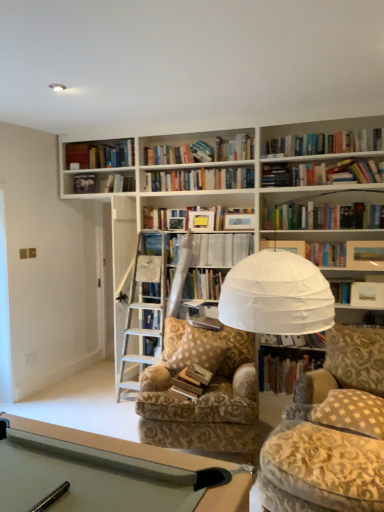
Question: From a real-world perspective, is brown checkered pillow at center, which ranks as the first pillow in left-to-right order, located beneath hardcover book at center?

Choices:
 (A) yes
 (B) no

Answer: (A)

Question: Is brown checkered pillow at center, the 1th pillow viewed from the back, facing away from hardcover book at center?

Choices:
 (A) no
 (B) yes

Answer: (B)

Question: From a real-world perspective, is brown checkered pillow at center, the second pillow when ordered from front to back, physically above hardcover book at center?

Choices:
 (A) yes
 (B) no

Answer: (B)

Question: From the image's perspective, would you say brown checkered pillow at center, the second pillow when ordered from front to back, is shown under hardcover book at center?

Choices:
 (A) yes
 (B) no

Answer: (A)

Question: Considering the relative sizes of brown checkered pillow at center, the 1th pillow viewed from the back, and hardcover book at center in the image provided, is brown checkered pillow at center, the 1th pillow viewed from the back, thinner than hardcover book at center?

Choices:
 (A) no
 (B) yes

Answer: (A)

Question: Is white paper at center, which is the 1th book in top-to-bottom order, wider or thinner than patterned fabric chair at center?

Choices:
 (A) thin
 (B) wide

Answer: (A)

Question: Is white paper at center, which is the 1th book in top-to-bottom order, spatially inside patterned fabric chair at center, or outside of it?

Choices:
 (A) outside
 (B) inside

Answer: (A)

Question: From their relative heights in the image, would you say white paper at center, the 4th book when ordered from bottom to top, is taller or shorter than patterned fabric chair at center?

Choices:
 (A) short
 (B) tall

Answer: (A)

Question: From the image's perspective, relative to patterned fabric chair at center, is white paper at center, the 4th book when ordered from bottom to top, above or below?

Choices:
 (A) below
 (B) above

Answer: (B)

Question: Is white checkered pillow at lower right, acting as the first pillow starting from the front, inside or outside of hardcover book at center?

Choices:
 (A) outside
 (B) inside

Answer: (A)

Question: In the image, is white checkered pillow at lower right, arranged as the 1th pillow when viewed from the right, on the left side or the right side of hardcover book at center?

Choices:
 (A) right
 (B) left

Answer: (A)

Question: Relative to hardcover book at center, is white checkered pillow at lower right, which is the 2th pillow from back to front, in front or behind?

Choices:
 (A) behind
 (B) front

Answer: (B)

Question: Looking at their shapes, would you say white checkered pillow at lower right, acting as the second pillow starting from the left, is wider or thinner than hardcover book at center?

Choices:
 (A) thin
 (B) wide

Answer: (B)

Question: Is point (200, 336) positioned closer to the camera than point (213, 326)?

Choices:
 (A) closer
 (B) farther

Answer: (A)

Question: Considering the positions of brown checkered pillow at center, the 1th pillow viewed from the back, and hardcover book at center in the image, is brown checkered pillow at center, the 1th pillow viewed from the back, bigger or smaller than hardcover book at center?

Choices:
 (A) big
 (B) small

Answer: (A)